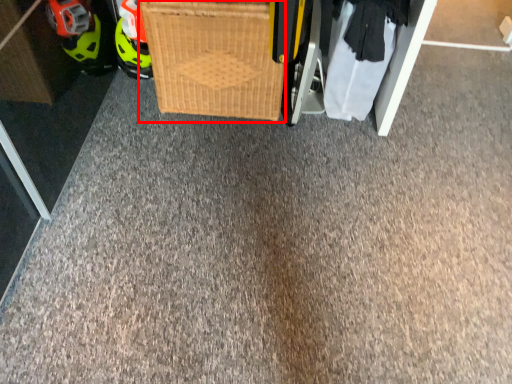
Question: Considering the relative positions of basket (annotated by the red box) and clothing in the image provided, where is basket (annotated by the red box) located with respect to the staircase?

Choices:
 (A) left
 (B) right

Answer: (A)